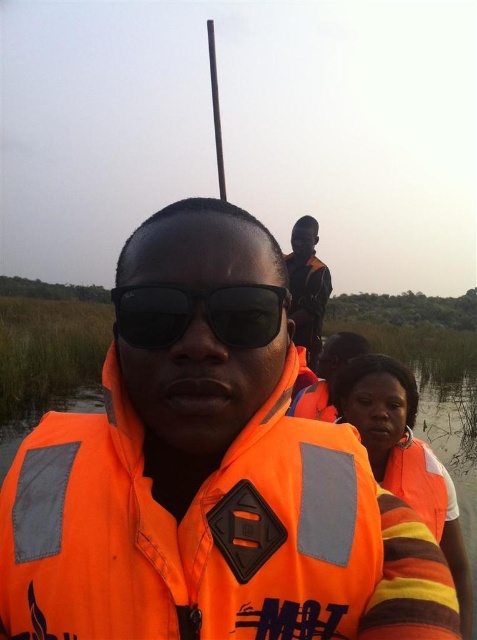
You are a safety inspector on the boat and need to ensure all workers are wearing their life jackets properly. According to the image, is the orange fabric construction worker at center wearing the orange fabric life jacket at lower right?

The orange fabric construction worker at center is located above the orange fabric life jacket at lower right, which means the life jacket is not being worn by the worker and is instead placed below them.

You are a safety inspector on the boat and need to ensure all workers are wearing proper safety gear. According to the image, is the orange fabric life jacket at center shorter than the orange fabric construction worker at center?

The orange fabric life jacket at center is not as tall as orange fabric construction worker at center, so yes, the life jacket is shorter than the construction worker.

From the picture: You are a safety inspector on the boat and need to ensure all safety gear is properly sized for the workers. The orange fabric construction worker at center is wearing the orange fabric life jacket at center. Is the life jacket appropriately sized for the worker?

The orange fabric life jacket at center has a smaller size compared to orange fabric construction worker at center, so the life jacket is not appropriately sized for the worker.